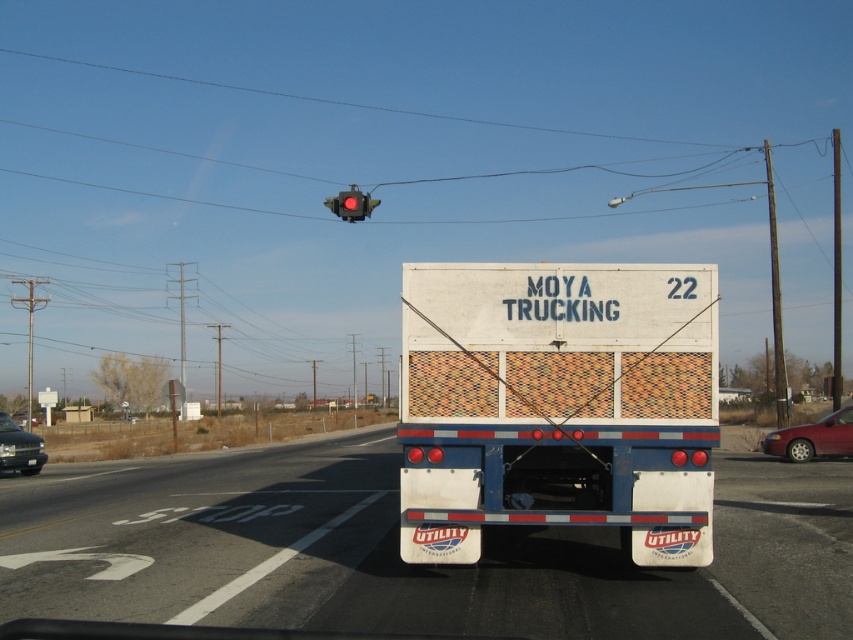
Question: Which of these objects is positioned closest to the white textured trailer truck at center?

Choices:
 (A) red glass traffic light at upper center
 (B) metallic red sedan at right

Answer: (A)

Question: Can you confirm if white textured trailer truck at center is smaller than metallic gray sedan at lower left?

Choices:
 (A) no
 (B) yes

Answer: (B)

Question: Which of the following is the farthest from the observer?

Choices:
 (A) (367, 200)
 (B) (10, 428)

Answer: (B)

Question: Considering the real-world distances, which object is farthest from the metallic gray sedan at lower left?

Choices:
 (A) metallic red sedan at right
 (B) white utility trailer at center
 (C) red glass traffic light at upper center

Answer: (C)

Question: Does white utility trailer at center appear on the right side of metallic red sedan at right?

Choices:
 (A) no
 (B) yes

Answer: (A)

Question: Is metallic gray sedan at lower left positioned in front of red glass traffic light at upper center?

Choices:
 (A) no
 (B) yes

Answer: (A)